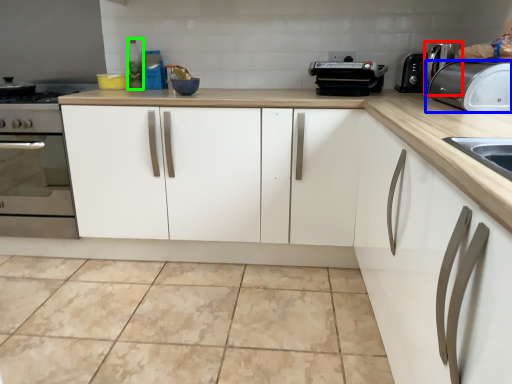
Question: Estimate the real-world distances between objects in this image. Which object is closer to coffee machine (highlighted by a red box), toaster (highlighted by a blue box) or bottle (highlighted by a green box)?

Choices:
 (A) toaster
 (B) bottle

Answer: (A)